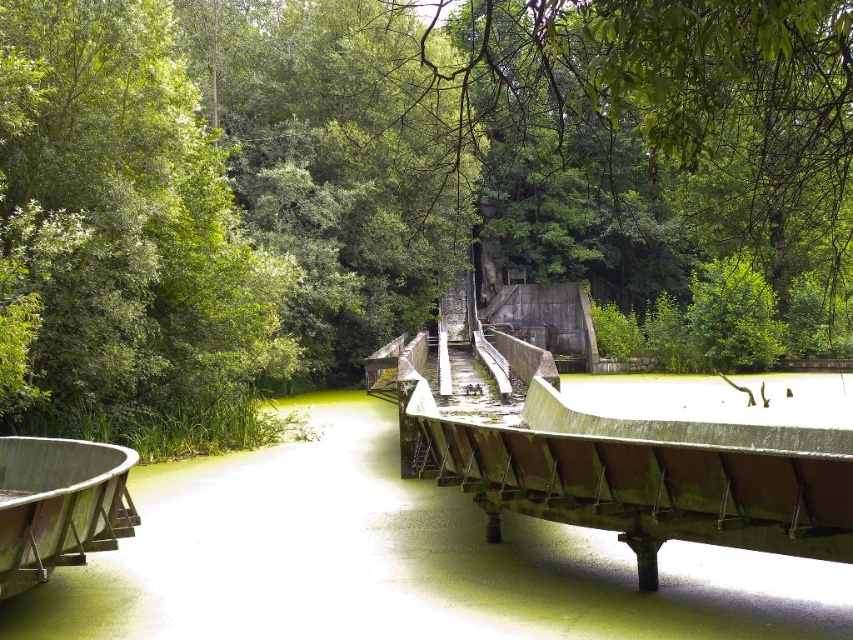
Who is positioned more to the right, green leafy tree at left or wooden boat at lower left?

wooden boat at lower left is more to the right.

Which is behind, point (189, 134) or point (36, 524)?

The point (189, 134) is more distant.

Locate an element on the screen. green leafy tree at left is located at coordinates (125, 220).

Is green algae-covered water at center below wooden boat at lower left?

Indeed, green algae-covered water at center is positioned under wooden boat at lower left.

Does green algae-covered water at center have a smaller size compared to wooden boat at lower left?

No.

Locate an element on the screen. Image resolution: width=853 pixels, height=640 pixels. green algae-covered water at center is located at coordinates (396, 561).

Which is more to the right, green leafy tree at center or green leafy tree at left?

From the viewer's perspective, green leafy tree at center appears more on the right side.

Is green leafy tree at center positioned at the back of green leafy tree at left?

That is False.

Is point (479, 42) less distant than point (218, 320)?

No, it is behind (218, 320).

Where is `green leafy tree at center`? The width and height of the screenshot is (853, 640). green leafy tree at center is located at coordinates (401, 182).